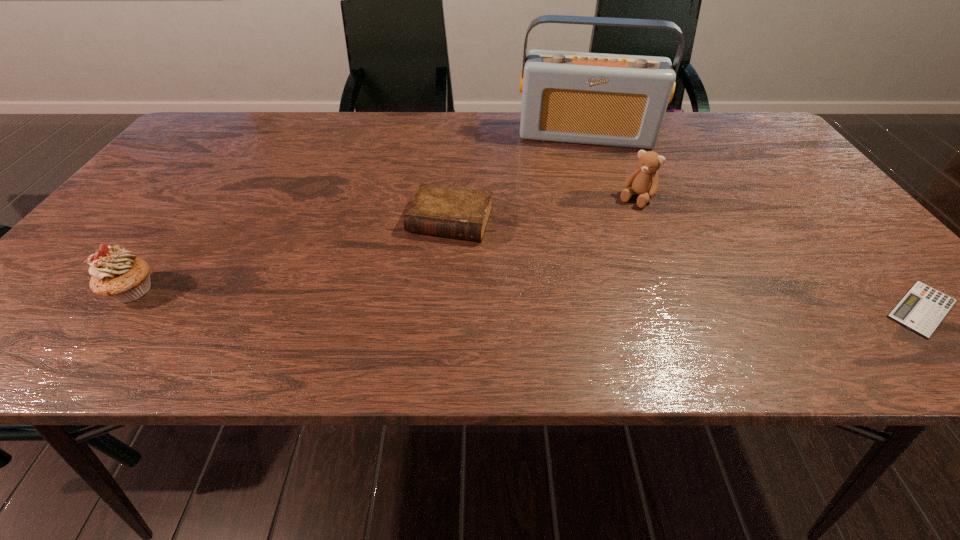
Identify the location of vacant spot on the desktop that is between the leftmost object and the rightmost object and is positioned on the front-facing side of the farthest object. (588, 301).

Image resolution: width=960 pixels, height=540 pixels. Find the location of `vacant space on the desktop that is between the cupcake and the rightmost object and is positioned on the front-facing side of the teddy bear`. vacant space on the desktop that is between the cupcake and the rightmost object and is positioned on the front-facing side of the teddy bear is located at coordinates (558, 300).

Where is `free space on the desktop that is between the cupcake and the calculator and is positioned on the spine side of the second shortest object`? free space on the desktop that is between the cupcake and the calculator and is positioned on the spine side of the second shortest object is located at coordinates (420, 297).